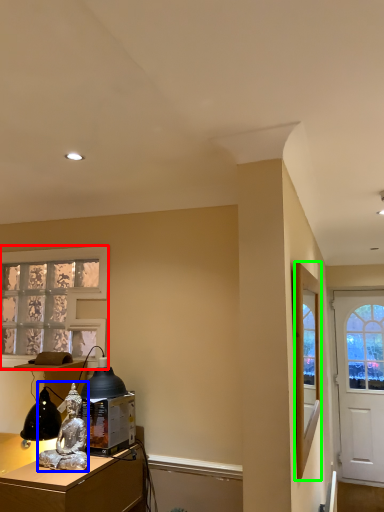
Question: Based on their relative distances, which object is nearer to window (highlighted by a red box)? Choose from person (highlighted by a blue box) and mirror (highlighted by a green box).

Choices:
 (A) person
 (B) mirror

Answer: (A)